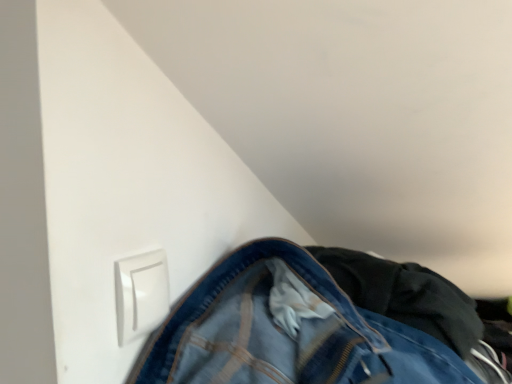
Question: Is white plastic switch at lower left bigger or smaller than denim at lower right?

Choices:
 (A) big
 (B) small

Answer: (B)

Question: From a real-world perspective, is white plastic switch at lower left physically located above or below denim at lower right?

Choices:
 (A) above
 (B) below

Answer: (A)

Question: From the image's perspective, is white plastic switch at lower left positioned above or below denim at lower right?

Choices:
 (A) above
 (B) below

Answer: (A)

Question: Is point (147, 377) closer or farther from the camera than point (156, 324)?

Choices:
 (A) farther
 (B) closer

Answer: (B)

Question: In the image, is denim at lower right positioned in front of or behind white plastic switch at lower left?

Choices:
 (A) front
 (B) behind

Answer: (B)

Question: Is denim at lower right wider or thinner than white plastic switch at lower left?

Choices:
 (A) wide
 (B) thin

Answer: (A)

Question: From their relative heights in the image, would you say denim at lower right is taller or shorter than white plastic switch at lower left?

Choices:
 (A) tall
 (B) short

Answer: (A)